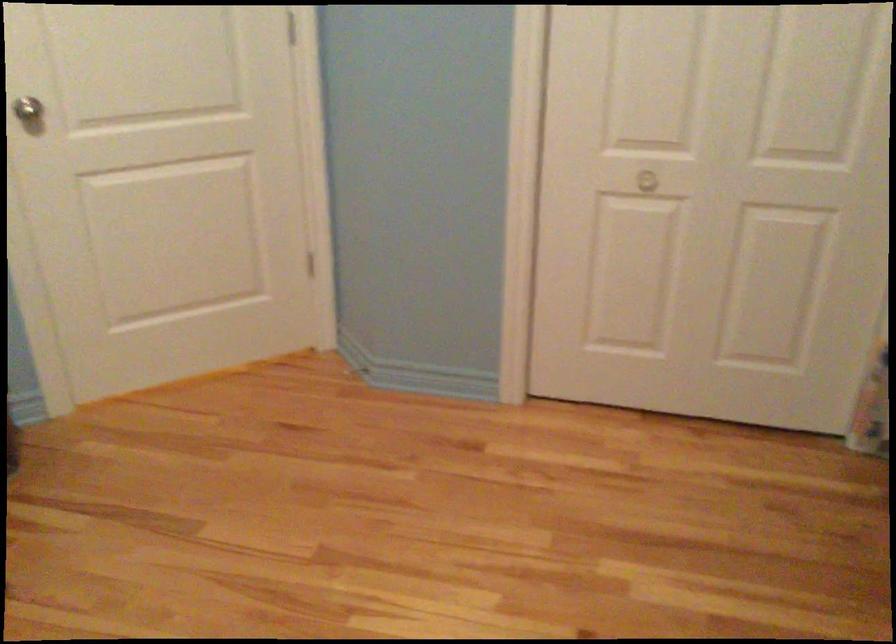
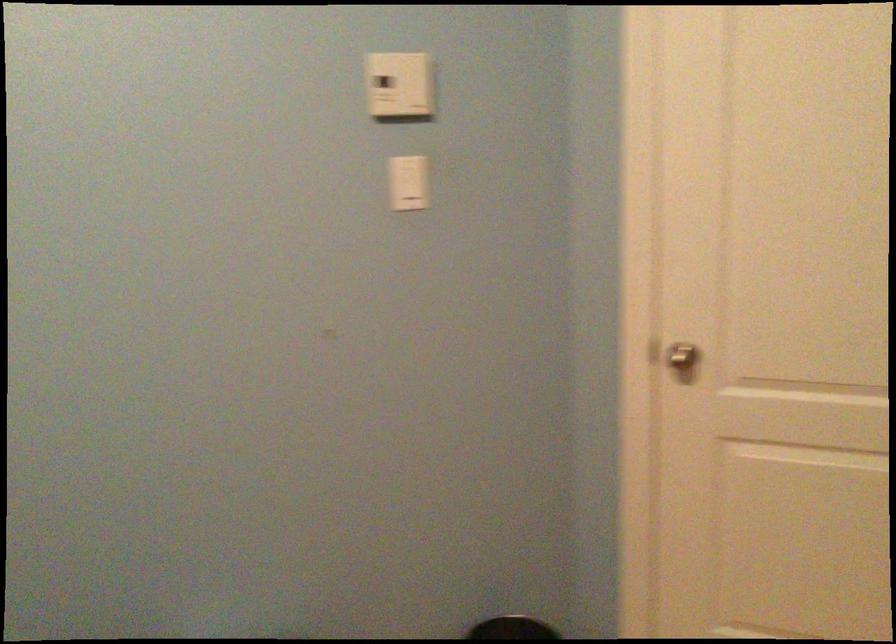
Question: The images are taken continuously from a first-person perspective. In which direction is your viewpoint rotating?

Choices:
 (A) Left
 (B) Right
 (C) Up
 (D) Down

Answer: (A)